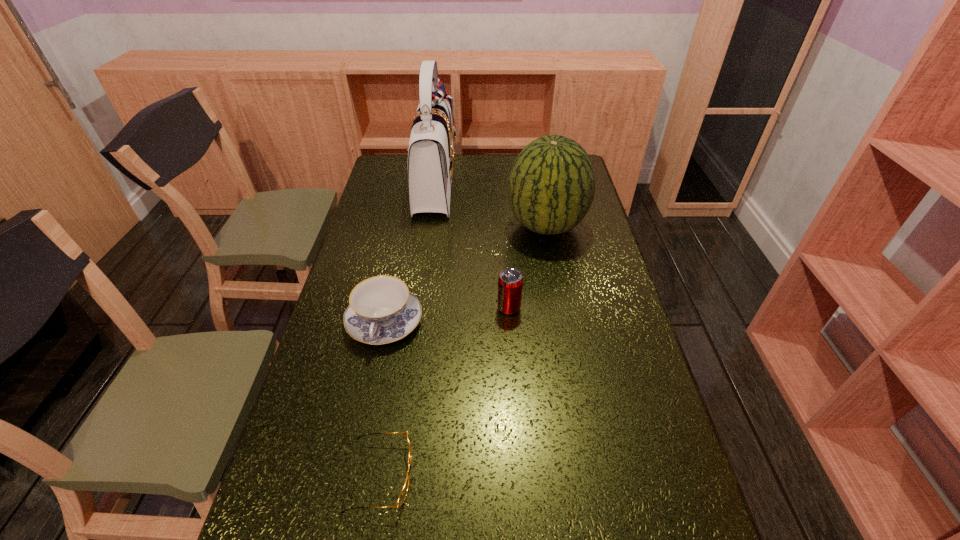
In order to click on the second closest object relative to the watermelon in this screenshot , I will do pyautogui.click(x=510, y=282).

Identify the location of vacant area in the image that satisfies the following two spatial constraints: 1. on the front-facing side of the third tallest object; 2. on the left side of the satchel. (417, 308).